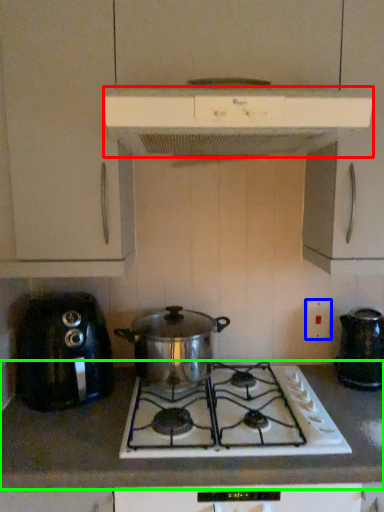
Question: Estimate the real-world distances between objects in this image. Which object is closer to kitchen appliance (highlighted by a red box), electric outlet (highlighted by a blue box) or countertop (highlighted by a green box)?

Choices:
 (A) electric outlet
 (B) countertop

Answer: (A)